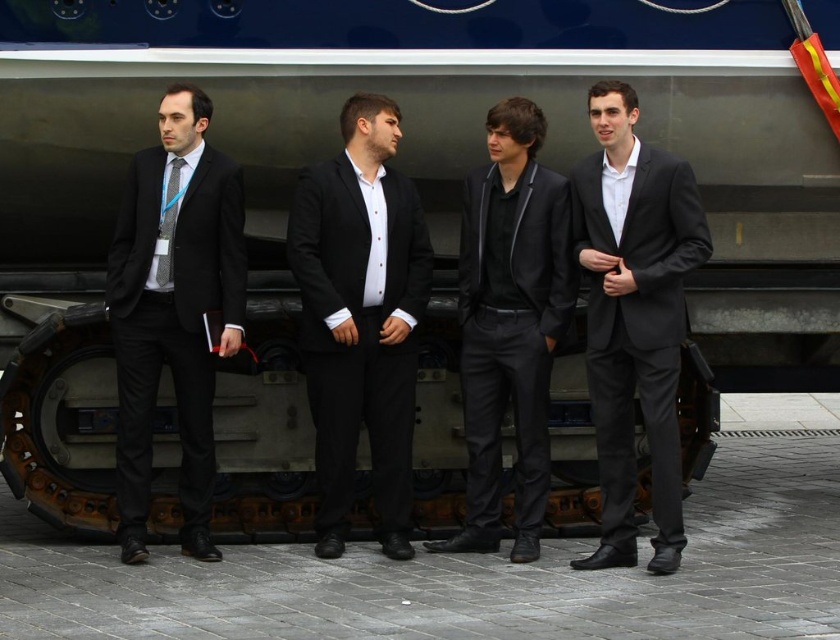
You are a photographer trying to capture a closeup of the matte black suit at left without including the matte black tie at left in the frame. Based on their positions, is this possible?

The matte black suit at left is in front of the matte black tie at left, so it is possible to capture a closeup of the matte black suit at left without including the matte black tie at left in the frame.

You are a photographer taking a group photo of the matte black suit at left and the matte black tie at left. Which object will appear bigger in the photo?

The matte black suit at left will appear bigger in the photo because it has a larger size compared to the matte black tie at left.